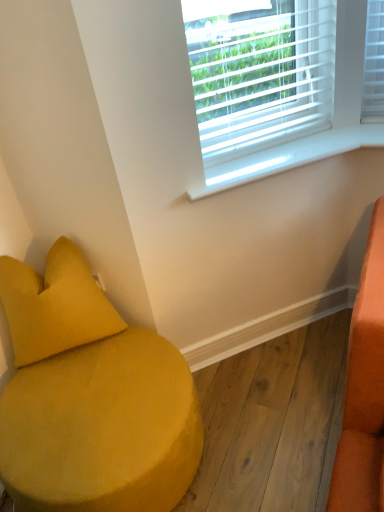
Question: Visually, is white plastic blinds at upper center positioned to the left or to the right of velvet yellow ottoman at lower left?

Choices:
 (A) right
 (B) left

Answer: (A)

Question: From their relative heights in the image, would you say white plastic blinds at upper center is taller or shorter than velvet yellow ottoman at lower left?

Choices:
 (A) short
 (B) tall

Answer: (B)

Question: Considering the real-world distances, which object is farthest from the velvet yellow ottoman at lower left?

Choices:
 (A) white plastic window sill at upper center
 (B) white plastic blinds at upper center
 (C) matte yellow pillow at lower left

Answer: (B)

Question: Which object is the closest to the white plastic blinds at upper center?

Choices:
 (A) matte yellow pillow at lower left
 (B) white plastic window sill at upper center
 (C) velvet yellow ottoman at lower left

Answer: (B)